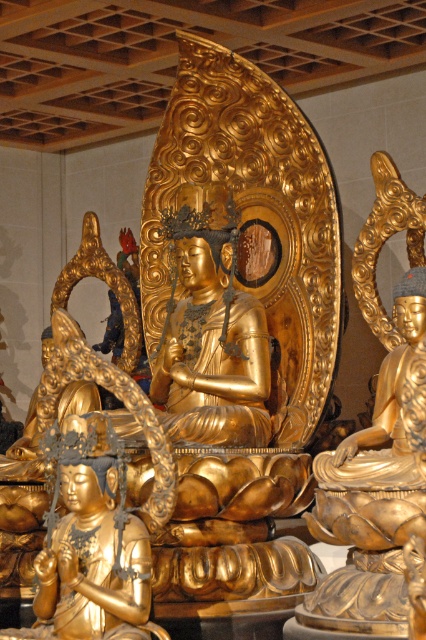
Question: Is gold polished statue at right smaller than gold/gilded statue at lower left?

Choices:
 (A) no
 (B) yes

Answer: (A)

Question: Which point appears farthest from the camera in this image?

Choices:
 (A) (400, 362)
 (B) (103, 465)

Answer: (A)

Question: Is gold polished statue at right in front of gold/gilded statue at lower left?

Choices:
 (A) yes
 (B) no

Answer: (A)

Question: Which point is closer to the camera?

Choices:
 (A) (417, 289)
 (B) (132, 532)

Answer: (B)

Question: Does gold polished statue at right appear under gold/gilded statue at lower left?

Choices:
 (A) no
 (B) yes

Answer: (A)